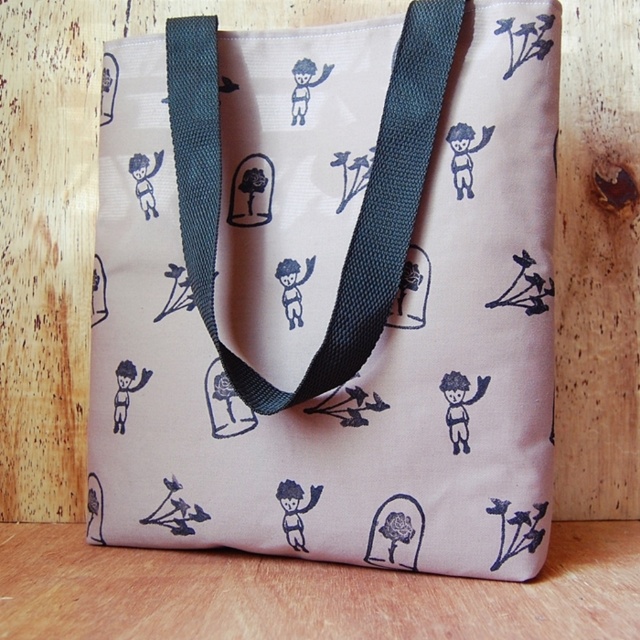
Based on the photo, you have a small keychain that you want to attach to the pink fabric tote at center and the black fabric strap at center. Which object would you choose if you want the keychain to be more visible?

The pink fabric tote at center has a larger size compared to the black fabric strap at center, so attaching the keychain to the pink fabric tote at center would make it more visible.

You are holding the pink fabric tote at center and want to adjust the black fabric strap at center. Which part of the tote bag should you reach towards to find the strap?

The black fabric strap at center is behind the pink fabric tote at center, so you should reach behind the pink fabric tote at center to find the strap.

You are holding a map that marks a hidden treasure location at point (x=330, y=289) on the tote bag. According to the scene description, what object is located at that coordinate?

The point (x=330, y=289) corresponds to the pink fabric tote at center.